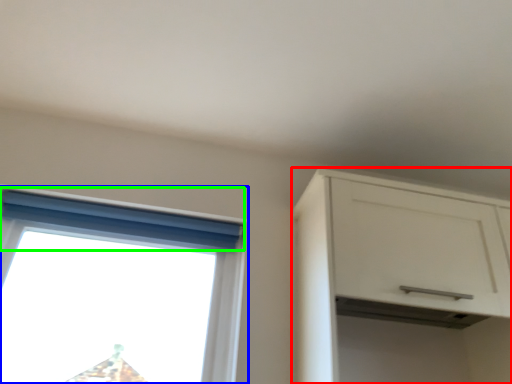
Question: Based on their relative distances, which object is nearer to cabinetry (highlighted by a red box)? Choose from window (highlighted by a blue box) and curtain (highlighted by a green box).

Choices:
 (A) window
 (B) curtain

Answer: (B)